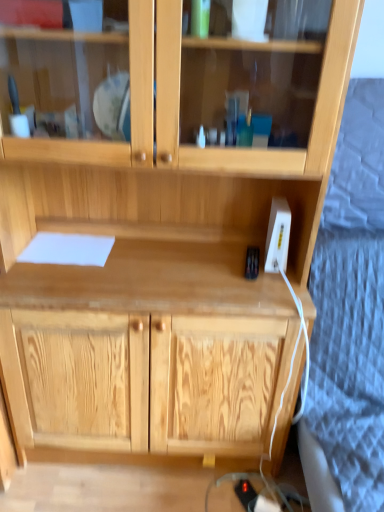
Locate an element on the screen. white plastic electric outlet at right is located at coordinates (277, 236).

Describe the element at coordinates (277, 236) in the screenshot. I see `white plastic electric outlet at right` at that location.

This screenshot has width=384, height=512. Find the location of `white plastic electric outlet at right`. white plastic electric outlet at right is located at coordinates (277, 236).